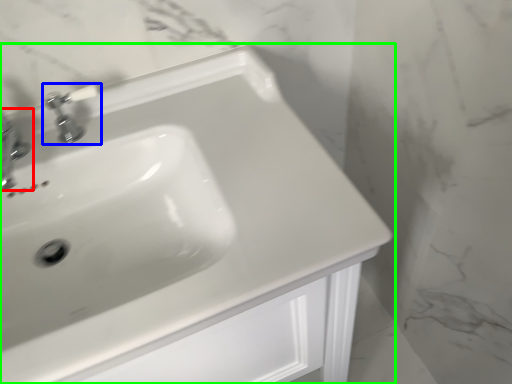
Question: Which object is the farthest from tap (highlighted by a red box)? Choose among these: tap (highlighted by a blue box) or sink (highlighted by a green box).

Choices:
 (A) tap
 (B) sink

Answer: (B)